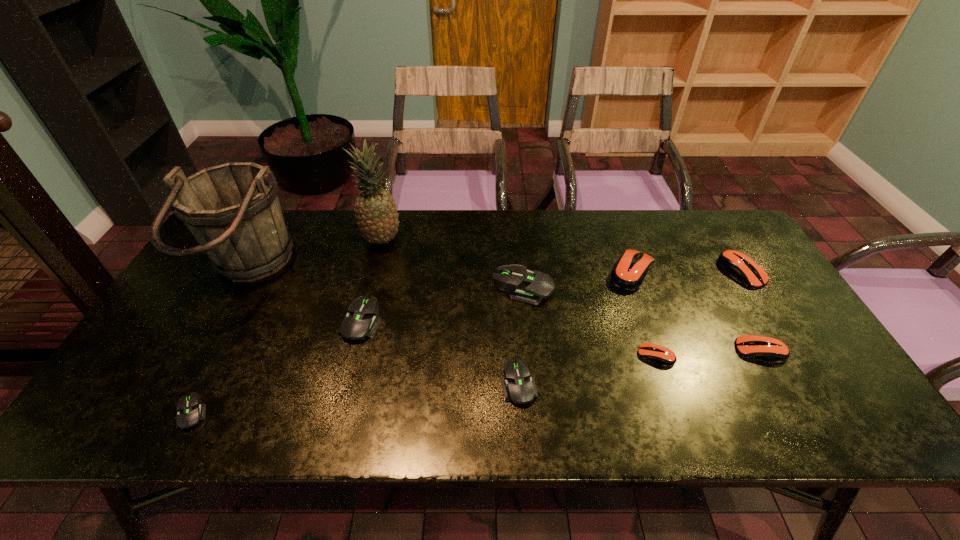
Locate an element on the screen. Image resolution: width=960 pixels, height=540 pixels. vacant space in between the smallest orange computer mouse and the biggest orange computer mouse is located at coordinates (644, 314).

Select which object appears as the sixth closest to the pineapple. Please provide its 2D coordinates. Your answer should be formatted as a tuple, i.e. [(x, y)], where the tuple contains the x and y coordinates of a point satisfying the conditions above.

[(629, 272)]

Image resolution: width=960 pixels, height=540 pixels. What are the coordinates of `object that is the fifth closest to the biggest gray computer mouse` in the screenshot? It's located at (360, 322).

The height and width of the screenshot is (540, 960). What are the coordinates of `computer mouse that can be found as the closest to the third smallest orange computer mouse` in the screenshot? It's located at (770, 349).

Select which computer mouse is the closest to the smallest orange computer mouse. Please provide its 2D coordinates. Your answer should be formatted as a tuple, i.e. [(x, y)], where the tuple contains the x and y coordinates of a point satisfying the conditions above.

[(770, 349)]

Find the location of a particular element. This screenshot has height=540, width=960. the third closest orange computer mouse to the third biggest orange computer mouse is located at coordinates (629, 272).

The width and height of the screenshot is (960, 540). Identify the location of the closest orange computer mouse relative to the smallest orange computer mouse. (770, 349).

You are a GUI agent. You are given a task and a screenshot of the screen. Output one action in this format:
    pyautogui.click(x=<x>, y=<y>)
    Task: Click on the gray computer mouse that is the nearest to the second biggest orange computer mouse
    
    Given the screenshot: What is the action you would take?
    pyautogui.click(x=523, y=285)

You are a GUI agent. You are given a task and a screenshot of the screen. Output one action in this format:
    pyautogui.click(x=<x>, y=<y>)
    Task: Click on the third closest gray computer mouse to the pineapple
    The height and width of the screenshot is (540, 960).
    Given the screenshot: What is the action you would take?
    pyautogui.click(x=519, y=387)

Where is `free region that satisfies the following two spatial constraints: 1. on the back side of the biggest gray computer mouse; 2. on the handle side of the bucket`? Image resolution: width=960 pixels, height=540 pixels. free region that satisfies the following two spatial constraints: 1. on the back side of the biggest gray computer mouse; 2. on the handle side of the bucket is located at coordinates (521, 273).